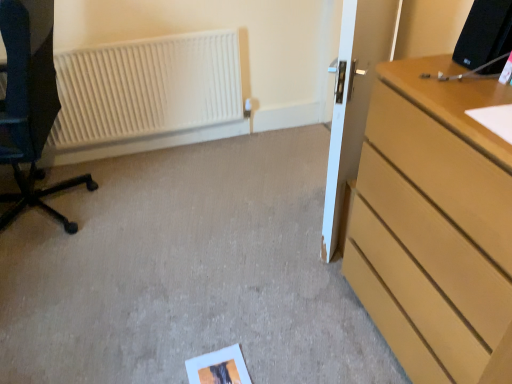
Question: From their relative heights in the image, would you say white matte radiator at upper left is taller or shorter than light wood dresser at right?

Choices:
 (A) short
 (B) tall

Answer: (A)

Question: Looking at the image, does white matte radiator at upper left seem bigger or smaller compared to light wood dresser at right?

Choices:
 (A) small
 (B) big

Answer: (A)

Question: Estimate the real-world distances between objects in this image. Which object is farther from the light wood dresser at right?

Choices:
 (A) matte black chair at left
 (B) white matte radiator at upper left
 (C) white glossy door at center

Answer: (B)

Question: Which object is positioned closest to the matte black chair at left?

Choices:
 (A) white matte radiator at upper left
 (B) white glossy door at center
 (C) light wood dresser at right

Answer: (A)